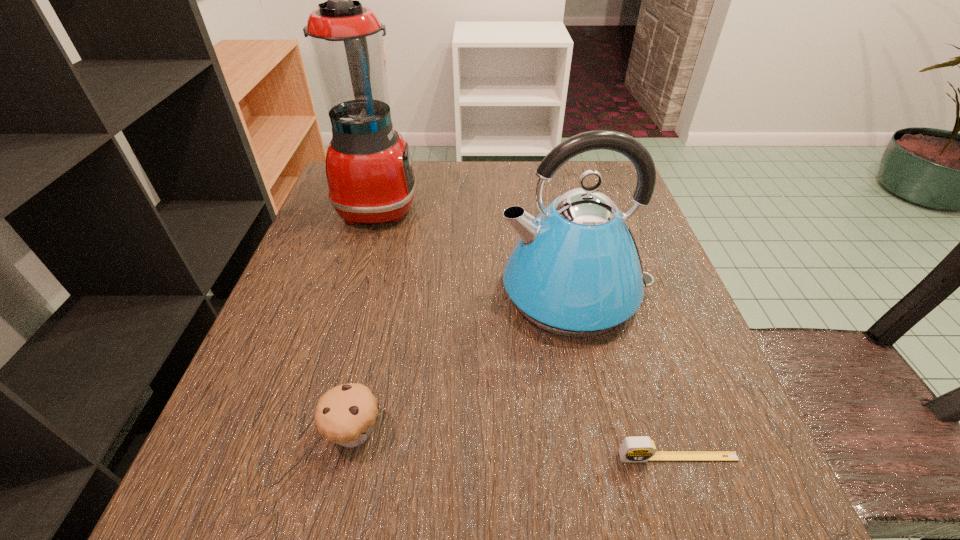
Find the location of a particular element. vacant space that satisfies the following two spatial constraints: 1. on the back side of the second shortest object; 2. on the controls of the farthest object is located at coordinates (404, 205).

This screenshot has width=960, height=540. Find the location of `free space that satisfies the following two spatial constraints: 1. at the spout of the second tallest object; 2. on the front side of the third tallest object`. free space that satisfies the following two spatial constraints: 1. at the spout of the second tallest object; 2. on the front side of the third tallest object is located at coordinates (606, 432).

Where is `vacant region that satisfies the following two spatial constraints: 1. on the controls of the muffin; 2. on the right side of the food processor`? The image size is (960, 540). vacant region that satisfies the following two spatial constraints: 1. on the controls of the muffin; 2. on the right side of the food processor is located at coordinates (310, 432).

Where is `vacant region that satisfies the following two spatial constraints: 1. on the controls of the farthest object; 2. on the left side of the third tallest object`? This screenshot has height=540, width=960. vacant region that satisfies the following two spatial constraints: 1. on the controls of the farthest object; 2. on the left side of the third tallest object is located at coordinates (310, 432).

Locate an element on the screen. Image resolution: width=960 pixels, height=540 pixels. vacant area in the image that satisfies the following two spatial constraints: 1. on the controls of the tallest object; 2. on the left side of the third tallest object is located at coordinates (x=310, y=432).